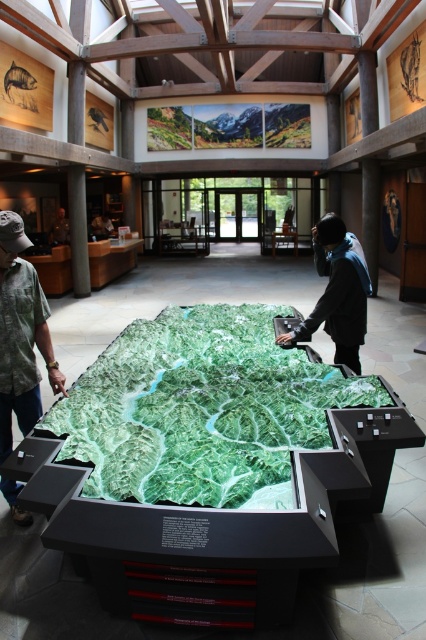
Does green camouflage shirt at left appear on the right side of matte black person at left?

Indeed, green camouflage shirt at left is positioned on the right side of matte black person at left.

Consider the image. Does green camouflage shirt at left have a larger size compared to matte black person at left?

No.

Is point (20, 298) less distant than point (68, 237)?

That is True.

Find the location of a particular element. green camouflage shirt at left is located at coordinates (20, 333).

Between dark gray jacket at center and matte black person at left, which one appears on the left side from the viewer's perspective?

Positioned to the left is matte black person at left.

Which is in front, point (313, 317) or point (69, 241)?

Point (313, 317) is in front.

Where is `dark gray jacket at center`? The image size is (426, 640). dark gray jacket at center is located at coordinates (337, 291).

Who is more distant from viewer, (x=34, y=310) or (x=351, y=241)?

The point (x=351, y=241) is more distant.

Can you confirm if green camouflage shirt at left is positioned to the left of dark gray jacket at center?

Indeed, green camouflage shirt at left is positioned on the left side of dark gray jacket at center.

Is point (5, 412) in front of point (321, 248)?

That is True.

In order to click on green camouflage shirt at left in this screenshot , I will do `click(20, 333)`.